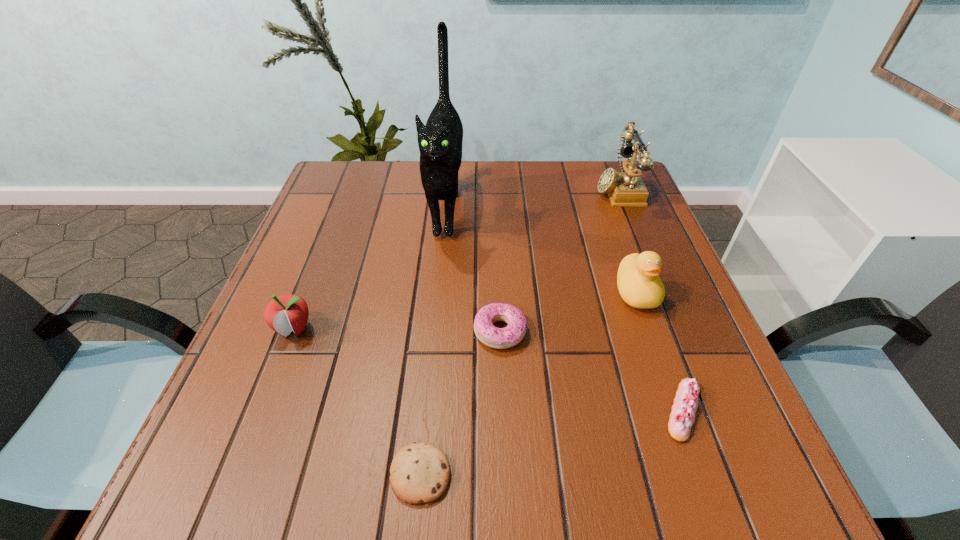
The width and height of the screenshot is (960, 540). In the image, there is a desktop. Find the location of `vacant area at the left edge`. vacant area at the left edge is located at coordinates (248, 353).

Identify the location of free spot at the right edge of the desktop. (621, 250).

In the image, there is a desktop. Where is `vacant area at the near left corner`? This screenshot has height=540, width=960. vacant area at the near left corner is located at coordinates (182, 507).

This screenshot has height=540, width=960. I want to click on vacant point located between the doughnut and the cookie, so click(460, 403).

You are a GUI agent. You are given a task and a screenshot of the screen. Output one action in this format:
    pyautogui.click(x=<x>, y=<y>)
    Task: Click on the vacant region between the leftmost object and the sixth shortest object
    The width and height of the screenshot is (960, 540).
    Given the screenshot: What is the action you would take?
    pyautogui.click(x=456, y=259)

The width and height of the screenshot is (960, 540). Identify the location of vacant space in between the fifth shortest object and the sixth shortest object. (627, 241).

Locate an element on the screen. The image size is (960, 540). free point between the cat and the second shortest object is located at coordinates (564, 308).

Locate an element on the screen. free area in between the nearest object and the apple is located at coordinates (357, 401).

Image resolution: width=960 pixels, height=540 pixels. Identify the location of unoccupied position between the fourth shortest object and the fifth tallest object. (397, 330).

Locate an element on the screen. free space between the fourth shortest object and the sixth shortest object is located at coordinates (456, 259).